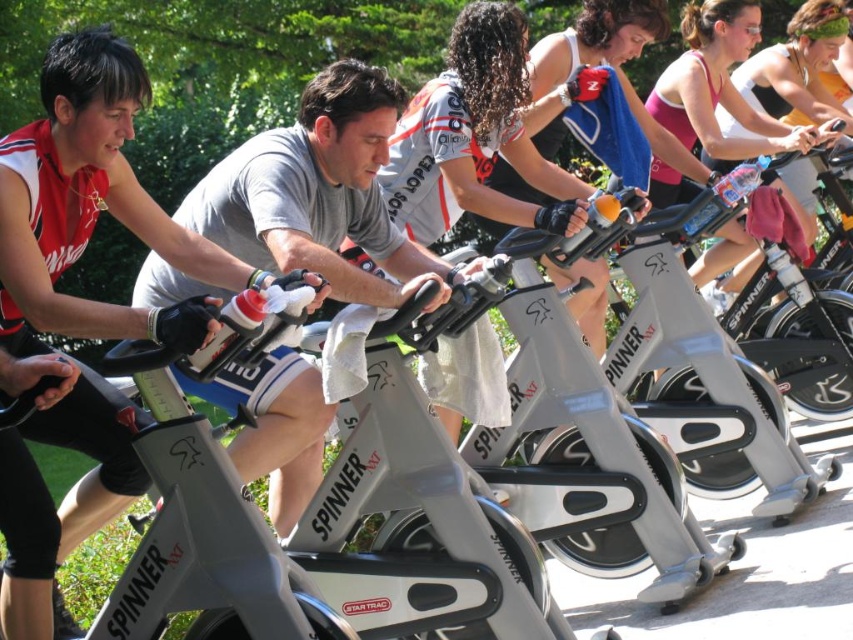
You are a photographer planning to take a group photo of the spinning class participants. You want to ensure both the gray matte spin bike at center and the pink fabric tank top at upper center are clearly visible. Considering their sizes, which object should you focus on first to ensure proper exposure?

The gray matte spin bike at center is larger in size than the pink fabric tank top at upper center, so you should focus on the gray matte spin bike at center first to ensure proper exposure since larger objects require more attention in lighting and focus.

You are a photographer setting up for an outdoor spinning class photo shoot. You need to position a spotlight to the right of the gray matte spin bike at center so it illuminates the matte black tank top at left. Is the spotlight placement feasible based on their positions?

The matte black tank top at left is to the left of the gray matte spin bike at center, so placing the spotlight to the right of the gray matte spin bike at center would position it opposite the tank top. This placement might not effectively illuminate the matte black tank top at left since the light would be directed away from it.

You are a photographer setting up for an outdoor spinning class photo shoot. You notice the matte black tank top at left and the gray matte spin bike at center. Which object should you adjust to ensure the tank top is no longer blocking the bike in the photo?

To ensure the matte black tank top at left is no longer blocking the gray matte spin bike at center, you should move the matte black tank top at left upwards since it is currently positioned under the bike.